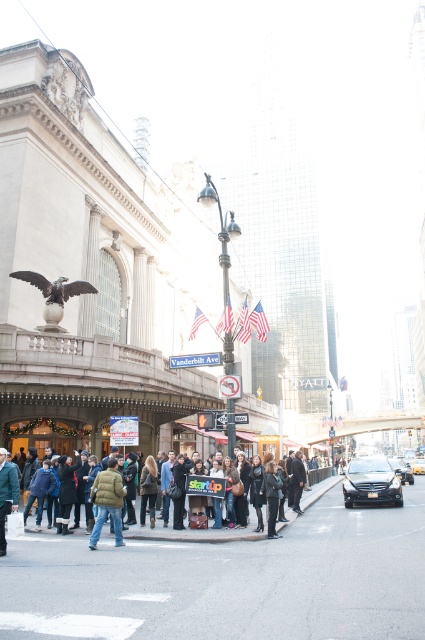
Is black metallic car at center taller than dark gray fabric crowd at center?

In fact, black metallic car at center may be shorter than dark gray fabric crowd at center.

The width and height of the screenshot is (425, 640). I want to click on black metallic car at center, so click(371, 483).

Image resolution: width=425 pixels, height=640 pixels. Identify the location of black metallic car at center. (371, 483).

Is khaki wool jacket at lower left wider than shiny bronze eagle at center?

Incorrect, khaki wool jacket at lower left's width does not surpass shiny bronze eagle at center's.

Which is above, khaki wool jacket at lower left or shiny bronze eagle at center?

shiny bronze eagle at center

Who is more forward, (x=102, y=496) or (x=96, y=289)?

Point (x=102, y=496) is more forward.

The height and width of the screenshot is (640, 425). In order to click on khaki wool jacket at lower left in this screenshot , I will do `click(107, 500)`.

Does point (2, 492) come closer to viewer compared to point (421, 460)?

Yes.

Can you confirm if dark blue jacket at lower left is taller than yellow rubber taxi at center?

No, dark blue jacket at lower left is not taller than yellow rubber taxi at center.

This screenshot has width=425, height=640. What do you see at coordinates (6, 493) in the screenshot?
I see `dark blue jacket at lower left` at bounding box center [6, 493].

Image resolution: width=425 pixels, height=640 pixels. I want to click on dark blue jacket at lower left, so click(6, 493).